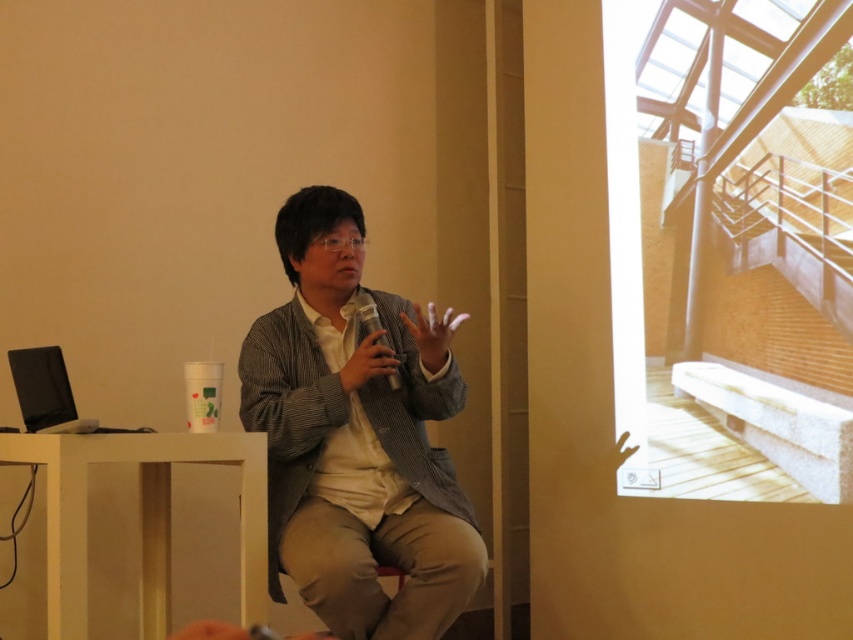
You are an assistant who needs to pass a document to the speaker. The document must be placed on the table near the metallic silver cup at center. Where should you place it relative to the matte gray hand at center?

You should place the document to the left of the matte gray hand at center since the matte gray hand at center is to the right of the metallic silver cup at center, meaning the cup is on the left side relative to the hand. Therefore, placing the document near the cup would require positioning it to the left of the hand.

You are a photographer trying to capture a closeup shot of the speaker. The camera you are using has a minimum focusing distance of 12 inches. If you want to focus on both the gray textured blazer at center and the matte gray hand at center, will you be able to do so without moving the camera?

The gray textured blazer at center and matte gray hand at center are 14.24 inches apart from each other. Since the minimum focusing distance of the camera is 12 inches, the distance between them exceeds this limit, so you cannot focus on both simultaneously without moving the camera.

You are organizing a small event and need to place a 30 cm wide decorative plate between the gray textured blazer at center and the metallic silver cup at center. Can you fit it there?

The distance between the gray textured blazer at center and the metallic silver cup at center is 28.48 centimeters. Since the plate is 30 cm wide, it cannot fit in the available space.